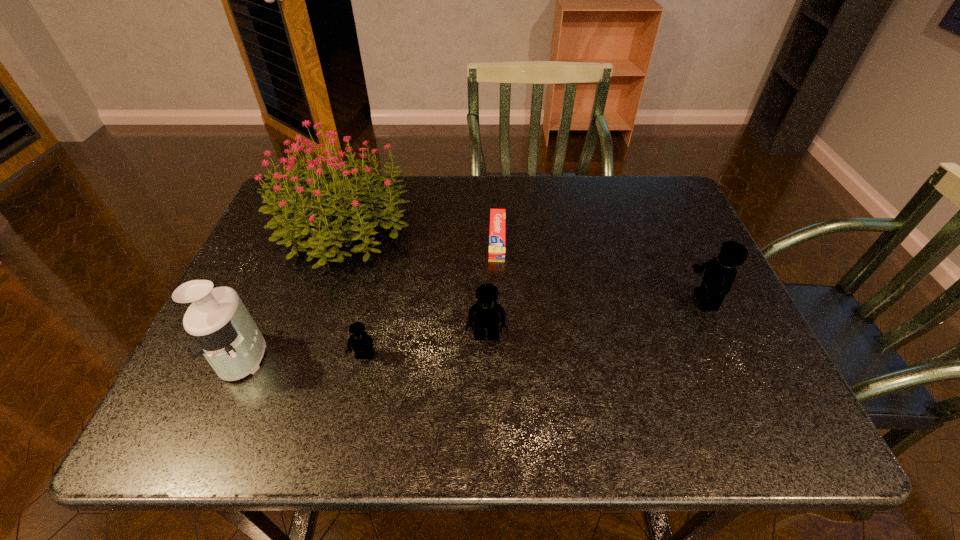
If we want them evenly spaced by inserting an extra Lego among them, please locate a free spot for this new Lego. Please provide its 2D coordinates. Your answer should be formatted as a tuple, i.e. [(x, y)], where the tuple contains the x and y coordinates of a point satisfying the conditions above.

[(599, 318)]